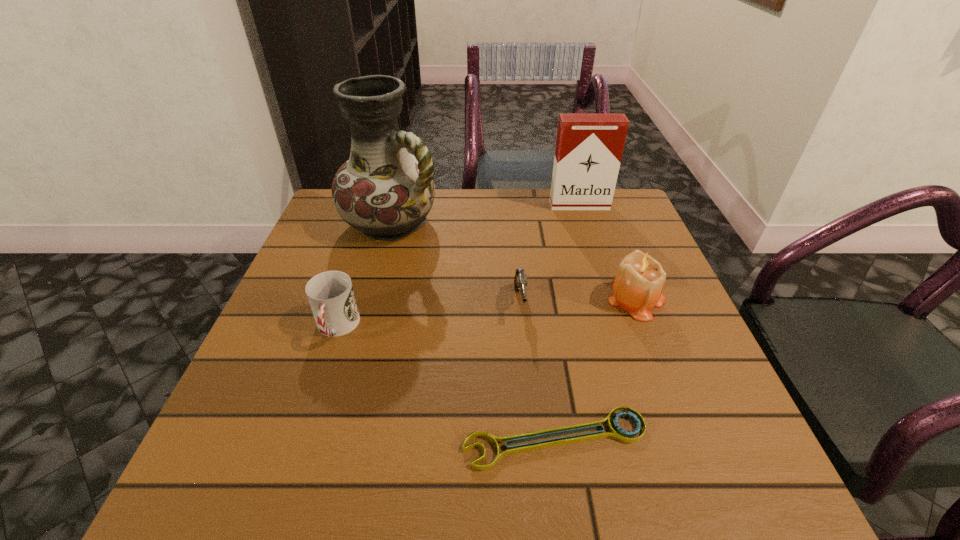
Find the location of a particular element. vase is located at coordinates (383, 191).

The image size is (960, 540). I want to click on the fifth shortest object, so click(x=589, y=147).

The height and width of the screenshot is (540, 960). In order to click on the fourth shortest object in this screenshot , I will do `click(637, 288)`.

Locate an element on the screen. cup is located at coordinates (330, 294).

You are a GUI agent. You are given a task and a screenshot of the screen. Output one action in this format:
    pyautogui.click(x=<x>, y=<y>)
    Task: Click on the fifth tallest object
    
    Given the screenshot: What is the action you would take?
    pyautogui.click(x=520, y=280)

This screenshot has height=540, width=960. In order to click on the nearest object in this screenshot , I will do `click(616, 432)`.

Where is `the shortest object`? the shortest object is located at coordinates pos(616,432).

Locate an element on the screen. vacant space located on the right of the vase is located at coordinates (564, 223).

Find the location of a particular element. The width and height of the screenshot is (960, 540). free spot located on the front-facing side of the cigarette_case is located at coordinates (612, 309).

Where is `vacant space located 0.310m on the left of the third tallest object`? The image size is (960, 540). vacant space located 0.310m on the left of the third tallest object is located at coordinates (462, 298).